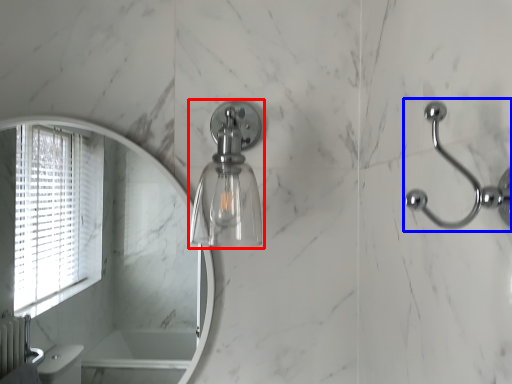
Question: Which point is further to the camera, soap dispenser (highlighted by a red box) or door handle (highlighted by a blue box)?

Choices:
 (A) soap dispenser
 (B) door handle

Answer: (A)